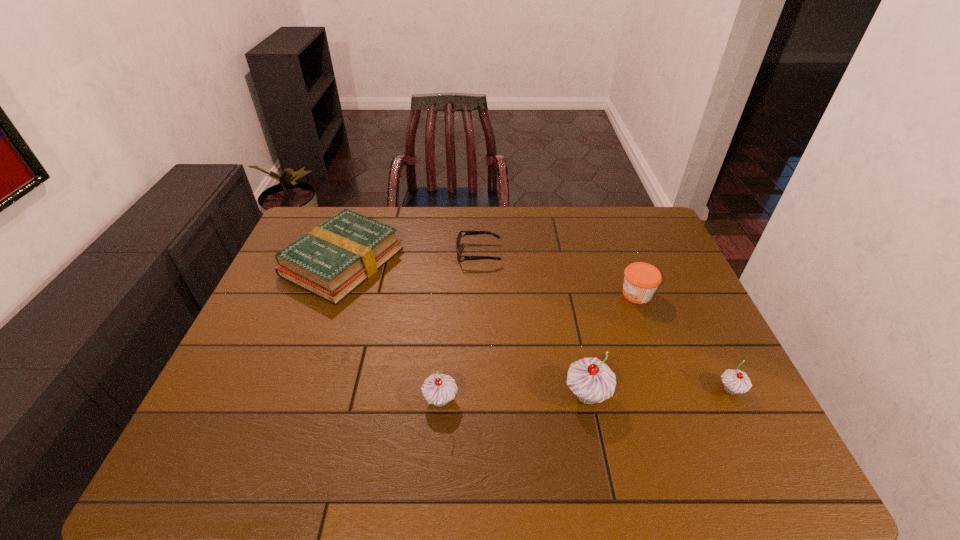
Identify which cupcake is the second closest to the third object from right to left. Please provide its 2D coordinates. Your answer should be formatted as a tuple, i.e. [(x, y)], where the tuple contains the x and y coordinates of a point satisfying the conditions above.

[(735, 381)]

Identify the location of vacant space that satisfies the following two spatial constraints: 1. on the front side of the tallest cupcake; 2. on the left side of the hardback book. The height and width of the screenshot is (540, 960). (296, 395).

Find the location of a particular element. vacant space that satisfies the following two spatial constraints: 1. on the front-facing side of the third object from right to left; 2. on the left side of the sunglasses is located at coordinates (478, 395).

At what (x,y) coordinates should I click in order to perform the action: click on free point that satisfies the following two spatial constraints: 1. on the front-facing side of the rightmost cupcake; 2. on the right side of the shortest object. Please return your answer as a coordinate pair (x, y). The height and width of the screenshot is (540, 960). Looking at the image, I should click on (478, 389).

In order to click on vacant point that satisfies the following two spatial constraints: 1. on the front label of the second object from right to left; 2. on the left side of the shortest cupcake in this screenshot , I will do `click(673, 389)`.

This screenshot has width=960, height=540. Find the location of `free space that satisfies the following two spatial constraints: 1. on the front-facing side of the rightmost object; 2. on the right side of the shortest object`. free space that satisfies the following two spatial constraints: 1. on the front-facing side of the rightmost object; 2. on the right side of the shortest object is located at coordinates (478, 389).

Locate an element on the screen. free space that satisfies the following two spatial constraints: 1. on the front label of the jam; 2. on the front side of the tallest object is located at coordinates (675, 395).